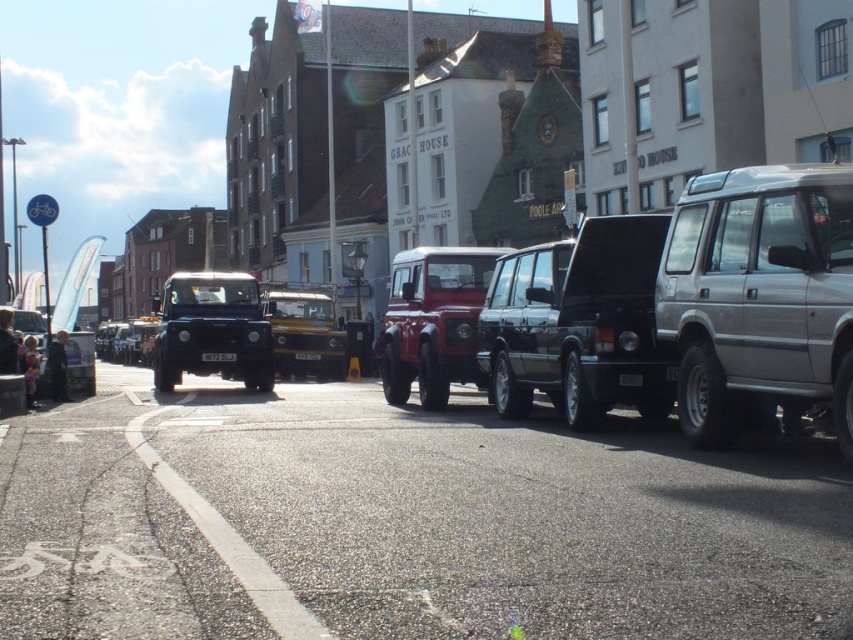
Is the position of white plastic license plate at center less distant than that of black plastic license plate at center?

That is True.

Is point (202, 355) positioned behind point (310, 355)?

No, (202, 355) is in front of (310, 355).

Where is `white plastic license plate at center`? This screenshot has height=640, width=853. white plastic license plate at center is located at coordinates (218, 356).

Between point (450, 324) and point (318, 356), which one is positioned in front?

Point (450, 324)

Is matte red suv at center thinner than black plastic license plate at center?

No, matte red suv at center is not thinner than black plastic license plate at center.

Where is `matte red suv at center`? The image size is (853, 640). matte red suv at center is located at coordinates (433, 321).

Where is `matte red suv at center`? Image resolution: width=853 pixels, height=640 pixels. matte red suv at center is located at coordinates (433, 321).

Does point (408, 310) come closer to viewer compared to point (310, 323)?

Yes, point (408, 310) is in front of point (310, 323).

Does matte red suv at center appear on the left side of metallic yellow jeep at center?

Incorrect, matte red suv at center is not on the left side of metallic yellow jeep at center.

Who is more distant from viewer, [432,284] or [338,344]?

Point [338,344]

Identify the location of matte red suv at center. (433, 321).